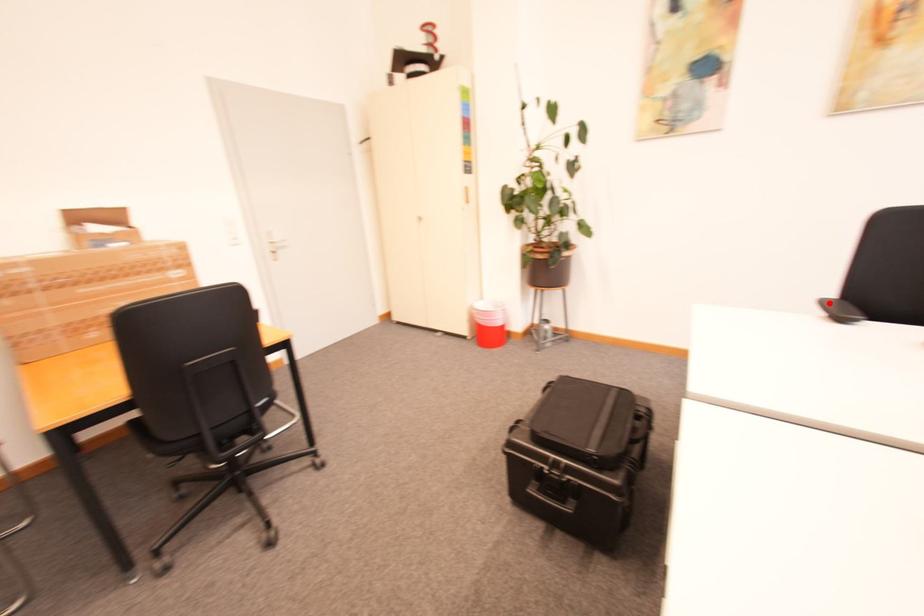
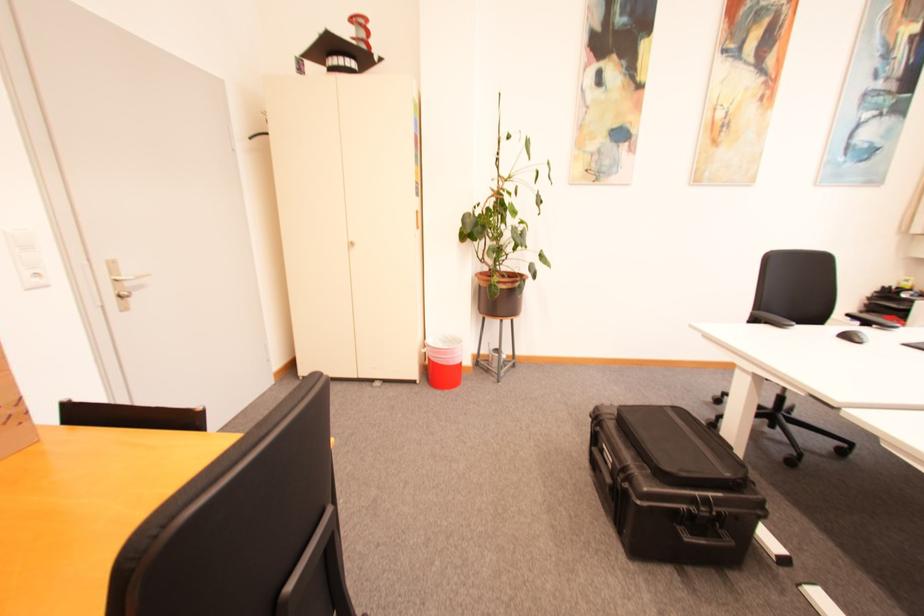
Where in the second image is the point corresponding to the highlighted location from the first image?

(759, 315)